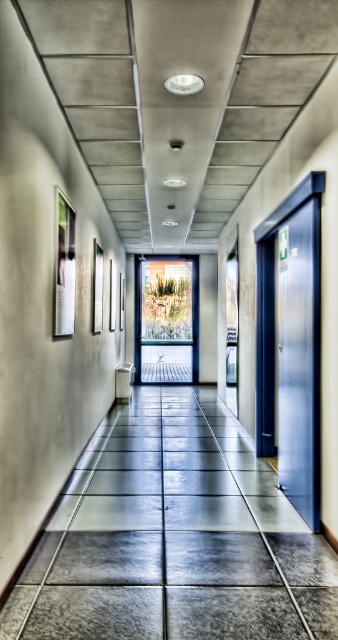
Does gray tile floor at center appear on the right side of metallic blue door at right?

Incorrect, gray tile floor at center is not on the right side of metallic blue door at right.

The width and height of the screenshot is (338, 640). Describe the element at coordinates (174, 538) in the screenshot. I see `gray tile floor at center` at that location.

Where is `gray tile floor at center`? The image size is (338, 640). gray tile floor at center is located at coordinates (174, 538).

I want to click on gray tile floor at center, so click(x=174, y=538).